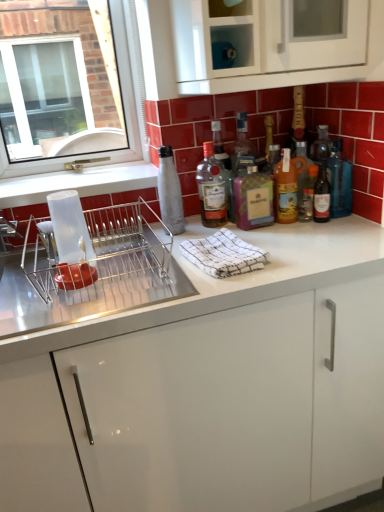
The image size is (384, 512). I want to click on free spot to the right of translucent amber bottle at center, which appears as the fourth bottle when viewed from the left, so click(350, 224).